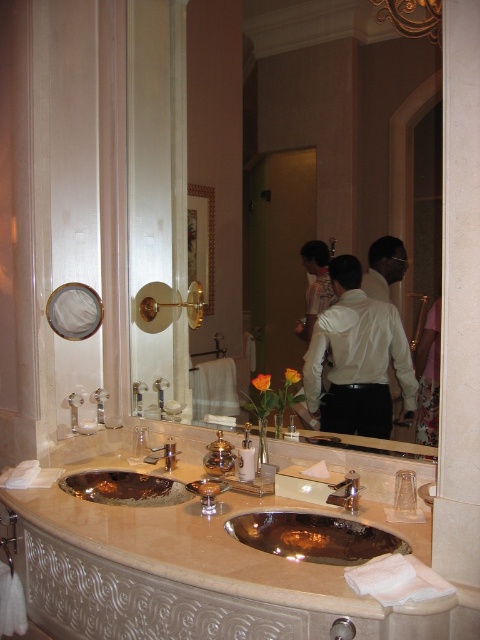
Question: Does brushed metal faucet at center have a larger size compared to brushed metal faucet at sink left?

Choices:
 (A) yes
 (B) no

Answer: (B)

Question: Does beige marble countertop at center appear on the left side of white satin shirt at center?

Choices:
 (A) yes
 (B) no

Answer: (A)

Question: Which point is closer to the camera?

Choices:
 (A) beige marble countertop at center
 (B) gold metallic mirror at center
 (C) brushed metal faucet at sink left

Answer: (A)

Question: Which point is farther to the camera?

Choices:
 (A) metallic polished sink at center
 (B) white satin shirt at center
 (C) bronze metallic sink at center

Answer: (C)

Question: Can you confirm if beige marble countertop at center is smaller than gold metallic mirror at center?

Choices:
 (A) no
 (B) yes

Answer: (B)

Question: Based on their relative distances, which object is farther from the white satin shirt at center?

Choices:
 (A) gold metallic mirror at center
 (B) beige marble countertop at center
 (C) brushed metal faucet at sink left

Answer: (C)